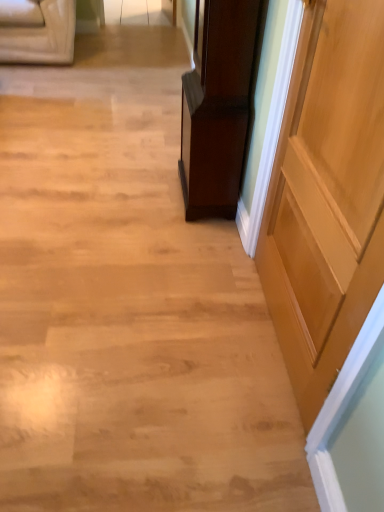
Find the location of a particular element. The image size is (384, 512). free location in front of light brown wood door at right is located at coordinates tap(223, 424).